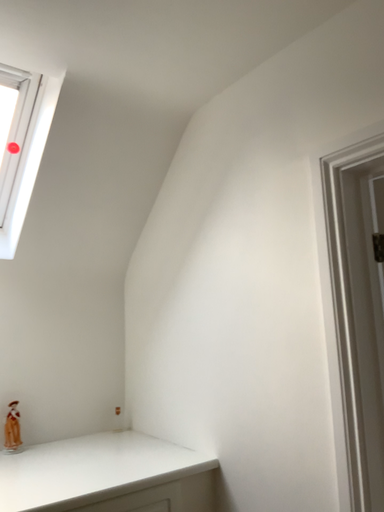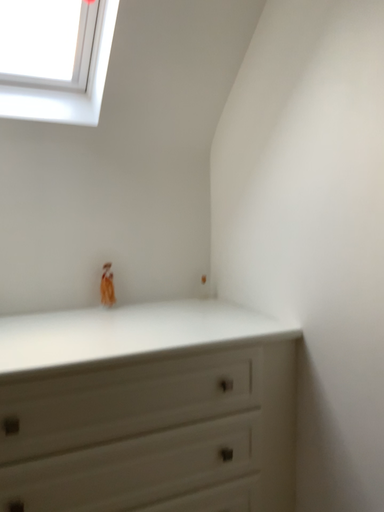
Question: How did the camera likely rotate when shooting the video?

Choices:
 (A) rotated right
 (B) rotated left

Answer: (B)